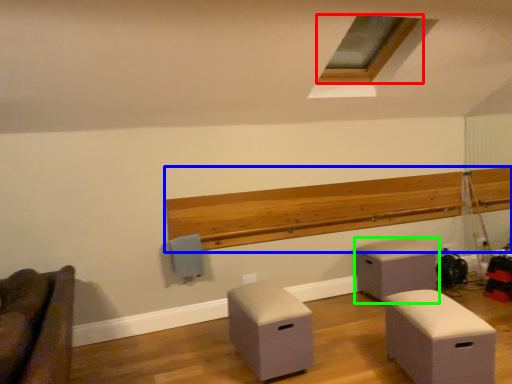
Question: Which object is the closest to the window (highlighted by a red box)? Choose among these: ledge (highlighted by a blue box) or furniture (highlighted by a green box).

Choices:
 (A) ledge
 (B) furniture

Answer: (A)